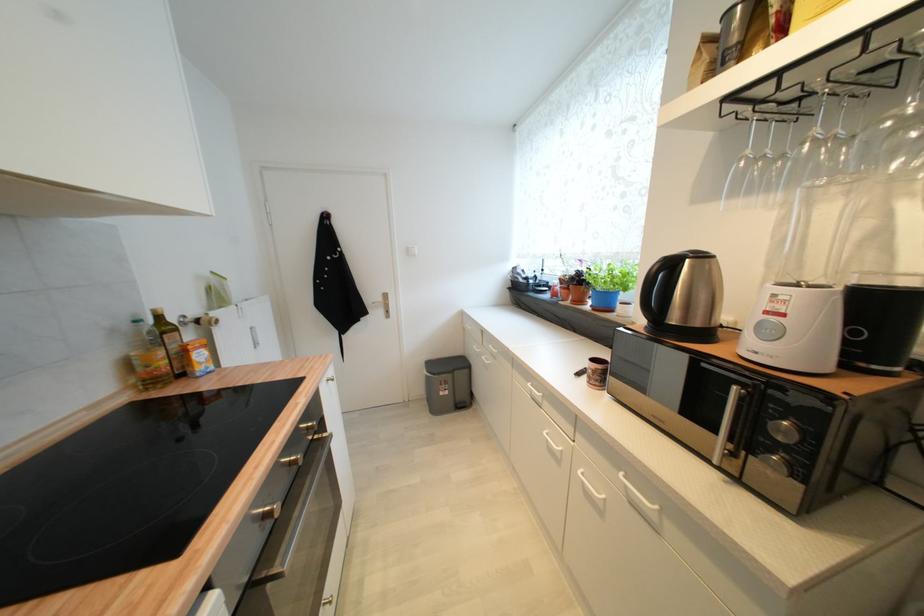
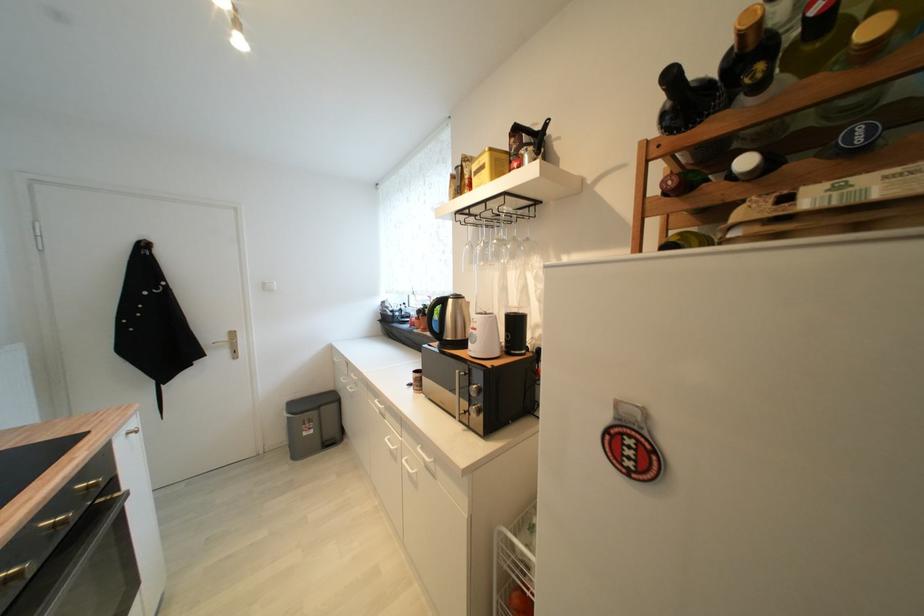
The point at (385, 301) is marked in the first image. Where is the corresponding point in the second image?

(229, 339)